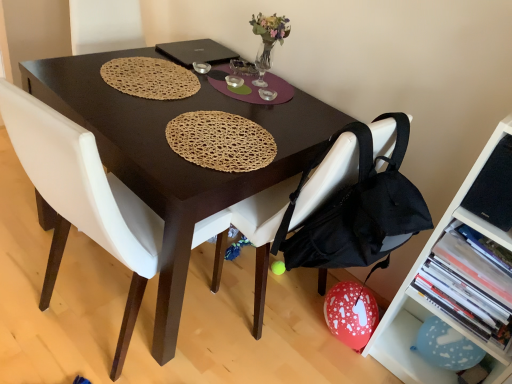
What is the approximate width of blue paper balloon at lower right, which is the first shelf from bottom to top?

blue paper balloon at lower right, which is the first shelf from bottom to top, is 6.38 inches in width.

In order to face hardcover book at lower right, should I rotate leftwards or rightwards?

To align with it, rotate right about 29.002°.

Describe the element at coordinates (83, 199) in the screenshot. The image size is (512, 384). I see `white leather chair at center, the first chair viewed from the left` at that location.

This screenshot has height=384, width=512. Describe the element at coordinates (268, 40) in the screenshot. I see `translucent glass vase at upper center` at that location.

Where is `black matte laptop at center`? Image resolution: width=512 pixels, height=384 pixels. black matte laptop at center is located at coordinates (196, 52).

Find the location of a particular element. This screenshot has width=512, height=384. metallic silver bowl at center is located at coordinates (201, 67).

The height and width of the screenshot is (384, 512). What do you see at coordinates (201, 67) in the screenshot? I see `metallic silver bowl at center` at bounding box center [201, 67].

Image resolution: width=512 pixels, height=384 pixels. In order to click on blue paper balloon at lower right, which is the first shelf from bottom to top in this screenshot , I will do `click(415, 340)`.

Considering the relative sizes of woven brown placemat at upper center and black fabric chair at lower right, which is the 1th chair in right-to-left order, in the image provided, is woven brown placemat at upper center wider than black fabric chair at lower right, which is the 1th chair in right-to-left order,?

In fact, woven brown placemat at upper center might be narrower than black fabric chair at lower right, which is the 1th chair in right-to-left order.

Is point (137, 95) behind point (348, 143)?

Yes, point (137, 95) is farther from viewer.

Is woven brown placemat at upper center directly adjacent to black fabric chair at lower right, the 2th chair in the left-to-right sequence?

No.

Based on the photo, is metallic silver bowl at center spatially inside white leather chair at center, which is the 2th chair in right-to-left order, or outside of it?

metallic silver bowl at center exists outside the volume of white leather chair at center, which is the 2th chair in right-to-left order.

From the picture: Is metallic silver bowl at center beside white leather chair at center, the first chair viewed from the left?

No, metallic silver bowl at center is not with white leather chair at center, the first chair viewed from the left.

At what (x,y) coordinates should I click in order to perform the action: click on chair on the left of metallic silver bowl at center. Please return your answer as a coordinate pair (x, y). The width and height of the screenshot is (512, 384). Looking at the image, I should click on (83, 199).

Is metallic silver bowl at center oriented away from white leather chair at center, which is the 2th chair in right-to-left order?

No, metallic silver bowl at center's orientation is not away from white leather chair at center, which is the 2th chair in right-to-left order.

Does hardcover book at lower right have a greater width compared to blue paper balloon at lower right, marked as the second shelf in a top-to-bottom arrangement?

Yes, hardcover book at lower right is wider than blue paper balloon at lower right, marked as the second shelf in a top-to-bottom arrangement.

Can you confirm if hardcover book at lower right is shorter than blue paper balloon at lower right, which is the first shelf from bottom to top?

A: Incorrect, the height of hardcover book at lower right does not fall short of that of blue paper balloon at lower right, which is the first shelf from bottom to top.

Is point (456, 320) less distant than point (479, 341)?

No, it is behind (479, 341).

Looking at this image, is hardcover book at lower right next to blue paper balloon at lower right, marked as the second shelf in a top-to-bottom arrangement, and touching it?

No, hardcover book at lower right is not touching blue paper balloon at lower right, marked as the second shelf in a top-to-bottom arrangement.

Is translucent glass vase at upper center further to the viewer compared to metallic silver bowl at center?

No, it is in front of metallic silver bowl at center.

Looking at this image, could you tell me if translucent glass vase at upper center is turned towards metallic silver bowl at center?

No, translucent glass vase at upper center is not oriented towards metallic silver bowl at center.

Consider the image. Is translucent glass vase at upper center not close to metallic silver bowl at center?

No, there isn't a large distance between translucent glass vase at upper center and metallic silver bowl at center.

Do you think translucent glass vase at upper center is within metallic silver bowl at center, or outside of it?

translucent glass vase at upper center is located beyond the bounds of metallic silver bowl at center.

Can you confirm if white plastic shelf at lower right, the second shelf when ordered from bottom to top, is shorter than blue paper balloon at lower right, which is the first shelf from bottom to top?

No.

Does white plastic shelf at lower right, the second shelf when ordered from bottom to top, have a larger size compared to blue paper balloon at lower right, which is the first shelf from bottom to top?

Yes.

From the image's perspective, is white plastic shelf at lower right, positioned as the first shelf in top-to-bottom order, above or below blue paper balloon at lower right, which is the first shelf from bottom to top?

From the image's perspective, white plastic shelf at lower right, positioned as the first shelf in top-to-bottom order, appears above blue paper balloon at lower right, which is the first shelf from bottom to top.

Is white plastic shelf at lower right, positioned as the first shelf in top-to-bottom order, to the right of blue paper balloon at lower right, marked as the second shelf in a top-to-bottom arrangement, from the viewer's perspective?

Correct, you'll find white plastic shelf at lower right, positioned as the first shelf in top-to-bottom order, to the right of blue paper balloon at lower right, marked as the second shelf in a top-to-bottom arrangement.

Is white plastic shelf at lower right, the second shelf when ordered from bottom to top, oriented away from black fabric chair at lower right, the 2th chair in the left-to-right sequence?

white plastic shelf at lower right, the second shelf when ordered from bottom to top, does not have its back to black fabric chair at lower right, the 2th chair in the left-to-right sequence.

From the image's perspective, does white plastic shelf at lower right, positioned as the first shelf in top-to-bottom order, appear higher than black fabric chair at lower right, which is the 1th chair in right-to-left order?

No, from the image's perspective, white plastic shelf at lower right, positioned as the first shelf in top-to-bottom order, is not over black fabric chair at lower right, which is the 1th chair in right-to-left order.

Is white plastic shelf at lower right, positioned as the first shelf in top-to-bottom order, to the right of black fabric chair at lower right, which is the 1th chair in right-to-left order, from the viewer's perspective?

Correct, you'll find white plastic shelf at lower right, positioned as the first shelf in top-to-bottom order, to the right of black fabric chair at lower right, which is the 1th chair in right-to-left order.

Is white plastic shelf at lower right, the second shelf when ordered from bottom to top, in contact with translucent glass vase at upper center?

No, white plastic shelf at lower right, the second shelf when ordered from bottom to top, is not beside translucent glass vase at upper center.

Considering the positions of objects white plastic shelf at lower right, positioned as the first shelf in top-to-bottom order, and translucent glass vase at upper center in the image provided, who is more to the right, white plastic shelf at lower right, positioned as the first shelf in top-to-bottom order, or translucent glass vase at upper center?

From the viewer's perspective, white plastic shelf at lower right, positioned as the first shelf in top-to-bottom order, appears more on the right side.

Locate an element on the screen. The image size is (512, 384). shelf that is the 1st one when counting downward from the translucent glass vase at upper center (from the image's perspective) is located at coordinates (426, 301).

From the picture: From a real-world perspective, is white plastic shelf at lower right, positioned as the first shelf in top-to-bottom order, positioned under translucent glass vase at upper center based on gravity?

Yes, from a real-world perspective, white plastic shelf at lower right, positioned as the first shelf in top-to-bottom order, is under translucent glass vase at upper center.

Locate an element on the screen. This screenshot has height=384, width=512. chair lying on the right of woven brown placemat at upper center is located at coordinates (263, 232).

You are a GUI agent. You are given a task and a screenshot of the screen. Output one action in this format:
    pyautogui.click(x=<x>, y=<y>)
    Task: Click on the tableware lying behind the white leather chair at center, the first chair viewed from the left
    
    Given the screenshot: What is the action you would take?
    pyautogui.click(x=201, y=67)

Based on their spatial positions, is black matte laptop at center or translucent glass vase at upper center closer to metallic silver bowl at center?

black matte laptop at center lies closer to metallic silver bowl at center than the other object.

Looking at the image, which one is located further to white plastic shelf at lower right, positioned as the first shelf in top-to-bottom order, hardcover book at lower right or white leather chair at center, the first chair viewed from the left?

white leather chair at center, the first chair viewed from the left, is positioned further to the anchor white plastic shelf at lower right, positioned as the first shelf in top-to-bottom order.

Estimate the real-world distances between objects in this image. Which object is further from black fabric chair at lower right, the 2th chair in the left-to-right sequence, white leather chair at center, which is the 2th chair in right-to-left order, or metallic silver bowl at center?

metallic silver bowl at center is positioned further to the anchor black fabric chair at lower right, the 2th chair in the left-to-right sequence.

Looking at the image, which one is located further to translucent glass vase at upper center, blue paper balloon at lower right, which is the first shelf from bottom to top, or black matte laptop at center?

blue paper balloon at lower right, which is the first shelf from bottom to top, lies further to translucent glass vase at upper center than the other object.

Which object lies further to the anchor point blue paper balloon at lower right, which is the first shelf from bottom to top, white plastic shelf at lower right, the second shelf when ordered from bottom to top, or woven brown placemat at upper center?

woven brown placemat at upper center is further to blue paper balloon at lower right, which is the first shelf from bottom to top.

Looking at the image, which one is located closer to metallic silver bowl at center, white plastic shelf at lower right, positioned as the first shelf in top-to-bottom order, or white leather chair at center, the first chair viewed from the left?

white leather chair at center, the first chair viewed from the left.

Based on their spatial positions, is black matte laptop at center or black fabric chair at lower right, the 2th chair in the left-to-right sequence, closer to hardcover book at lower right?

The object closer to hardcover book at lower right is black fabric chair at lower right, the 2th chair in the left-to-right sequence.

Looking at the image, which one is located closer to blue paper balloon at lower right, marked as the second shelf in a top-to-bottom arrangement, white plastic shelf at lower right, positioned as the first shelf in top-to-bottom order, or metallic silver bowl at center?

The object closer to blue paper balloon at lower right, marked as the second shelf in a top-to-bottom arrangement, is white plastic shelf at lower right, positioned as the first shelf in top-to-bottom order.

Identify the location of tableware situated between black matte laptop at center and translucent glass vase at upper center from left to right. (201, 67).

Where is `mat that lies between translucent glass vase at upper center and blue paper balloon at lower right, which is the first shelf from bottom to top, from top to bottom`? mat that lies between translucent glass vase at upper center and blue paper balloon at lower right, which is the first shelf from bottom to top, from top to bottom is located at coordinates (150, 78).

Locate an element on the screen. The width and height of the screenshot is (512, 384). book between metallic silver bowl at center and white plastic shelf at lower right, the second shelf when ordered from bottom to top is located at coordinates (467, 286).

The image size is (512, 384). In order to click on mat between black fabric chair at lower right, the 2th chair in the left-to-right sequence, and black matte laptop at center in the front-back direction in this screenshot , I will do `click(150, 78)`.